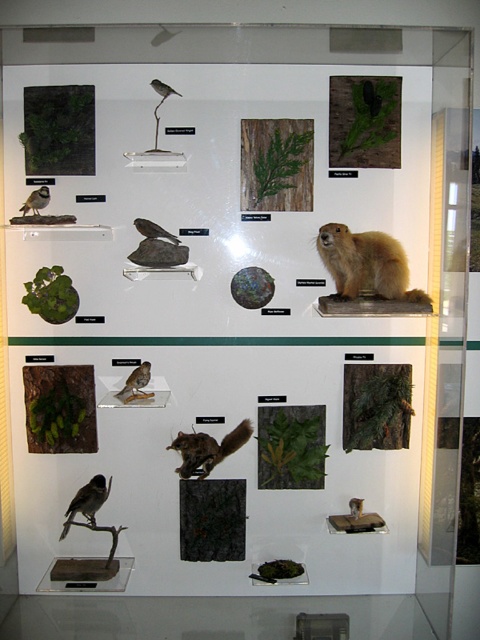
Looking at this image, you are a visitor in the museum standing in front of the display case. You notice two points marked inside the case. The first point is at coordinate point (126, 392) and the second is at point (36, 198). Which point is closer to you?

Point (126, 392) is closer to you because it is further to the viewer than point (36, 198).